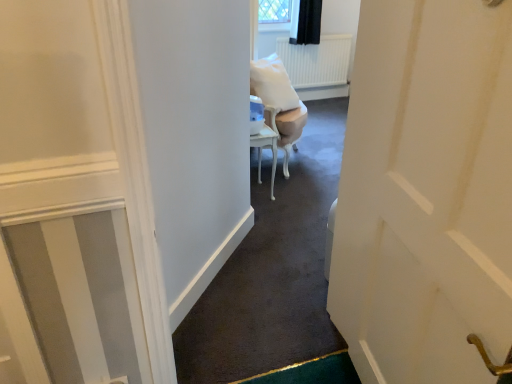
Find the location of `vacant area that is situated to the right of white glossy table at center`. vacant area that is situated to the right of white glossy table at center is located at coordinates (284, 187).